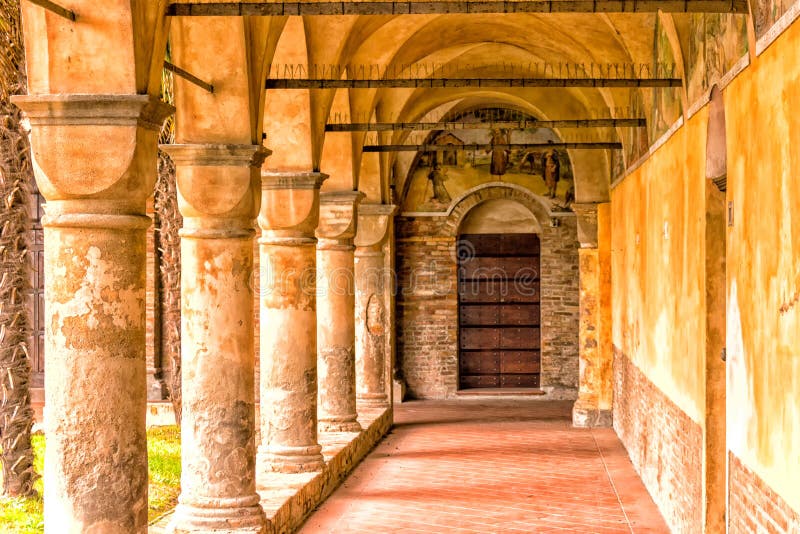
Where is `pillar`? The height and width of the screenshot is (534, 800). pillar is located at coordinates (92, 383), (208, 351), (284, 339), (328, 329), (380, 329), (597, 352).